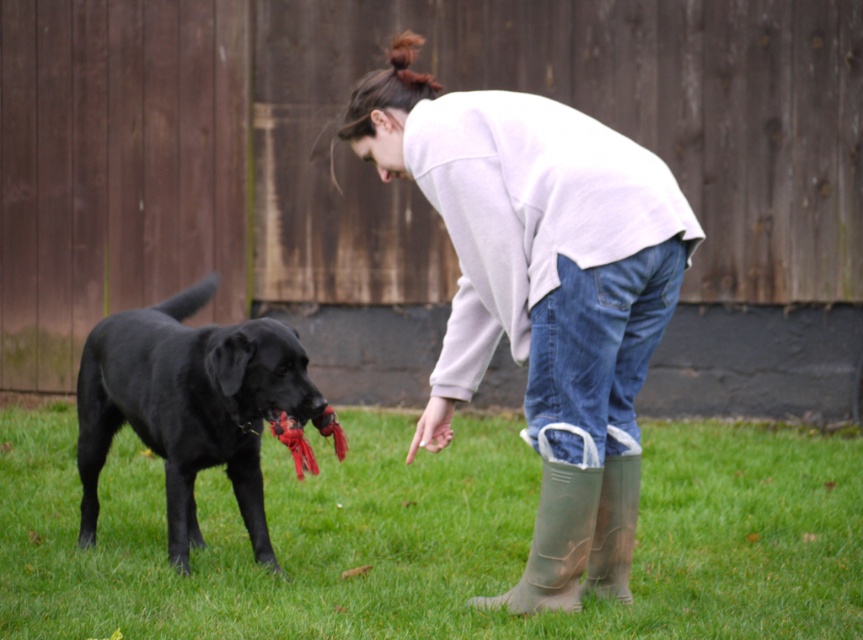
You are standing in the outdoor scene and want to place a small potted plant between the green grass at lower center and the white cotton sweatshirt at center. Based on their positions, which object should the potted plant be closer to?

The green grass at lower center is positioned on the left side of the white cotton sweatshirt at center, so the potted plant should be placed closer to the green grass at lower center to maintain the left alignment.

You are standing in the scene and want to place a small marker exactly where the green rubber boot at lower center is located. What are the coordinates where you should place the marker?

The coordinates for the green rubber boot at lower center are at point (x=555, y=541), so you should place the marker there.

You are standing in the scene and want to step forward to get closer to the shiny black dog at left. However, you notice the rubber boots at lower right. Based on their positions, will stepping forward block the path to the dog?

The rubber boots at lower right are behind the shiny black dog at left, so stepping forward towards the dog won wait be blocked by the boots since they are positioned behind the dog.